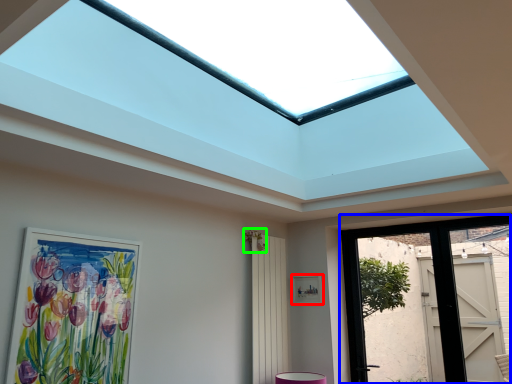
Question: Considering the real-world distances, which object is farthest from picture frame (highlighted by a red box)? door (highlighted by a blue box) or flower (highlighted by a green box)?

Choices:
 (A) door
 (B) flower

Answer: (A)